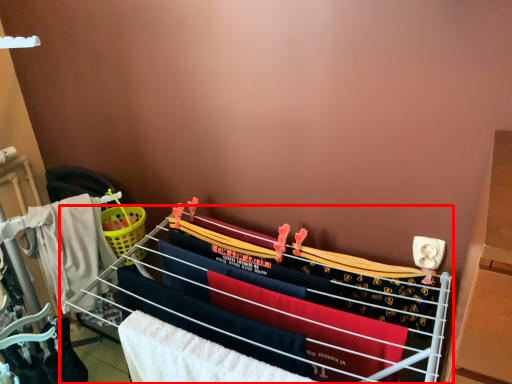
Question: In this image, where is furniture (annotated by the red box) located relative to beach towel?

Choices:
 (A) right
 (B) left

Answer: (A)